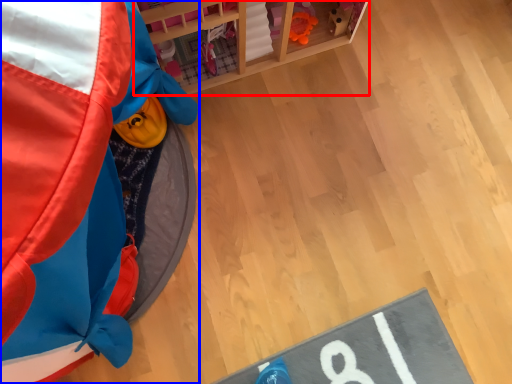
Question: Which object is further to the camera taking this photo, furniture (highlighted by a red box) or toy (highlighted by a blue box)?

Choices:
 (A) furniture
 (B) toy

Answer: (A)